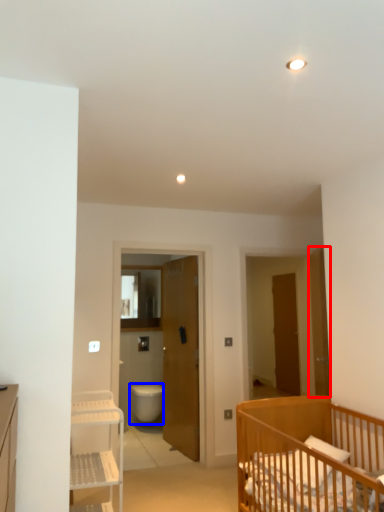
Question: Which object is further to the camera taking this photo, door (highlighted by a red box) or toilet bowl (highlighted by a blue box)?

Choices:
 (A) door
 (B) toilet bowl

Answer: (B)